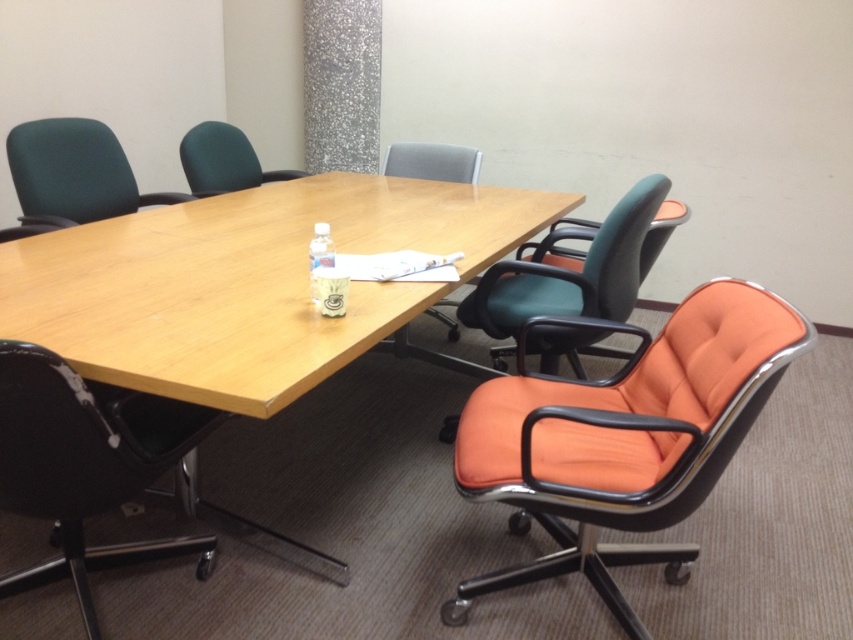
Does wooden table at center have a lesser width compared to black leather swivel chair at lower left?

No.

Is wooden table at center wider than black leather swivel chair at lower left?

Correct, the width of wooden table at center exceeds that of black leather swivel chair at lower left.

Locate an element on the screen. wooden table at center is located at coordinates (247, 282).

Does point (479, 291) lie in front of point (231, 168)?

That is True.

Who is shorter, orange fabric chair at right or matte green office chair at upper left?

matte green office chair at upper left is shorter.

Image resolution: width=853 pixels, height=640 pixels. What do you see at coordinates (572, 273) in the screenshot?
I see `orange fabric chair at right` at bounding box center [572, 273].

Find the location of `orange fabric chair at right`. orange fabric chair at right is located at coordinates (572, 273).

Does orange fabric swivel chair at right appear on the right side of black leather swivel chair at lower left?

Indeed, orange fabric swivel chair at right is positioned on the right side of black leather swivel chair at lower left.

Is orange fabric swivel chair at right positioned behind black leather swivel chair at lower left?

Yes, orange fabric swivel chair at right is behind black leather swivel chair at lower left.

Which is in front, point (796, 337) or point (122, 413)?

Positioned in front is point (796, 337).

This screenshot has height=640, width=853. I want to click on orange fabric swivel chair at right, so click(x=625, y=440).